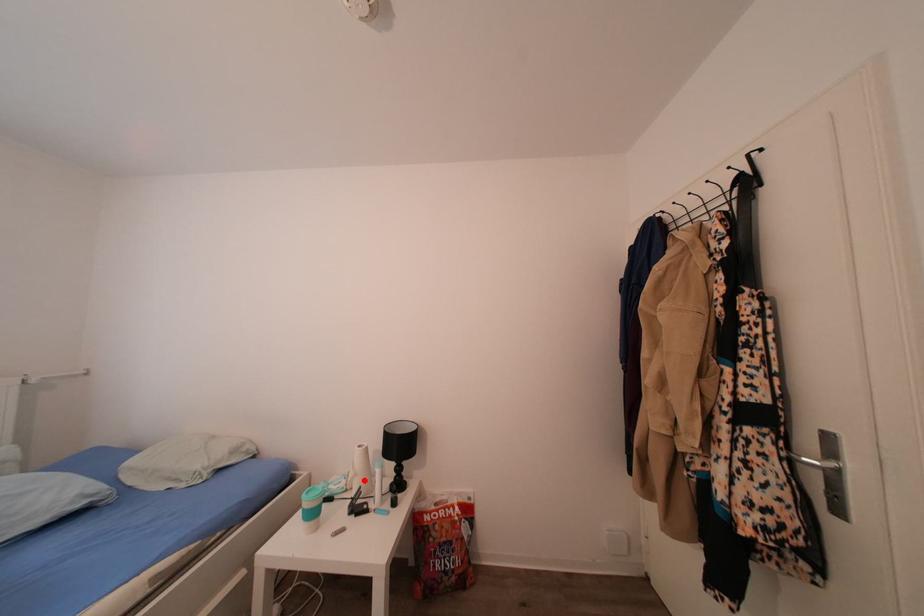
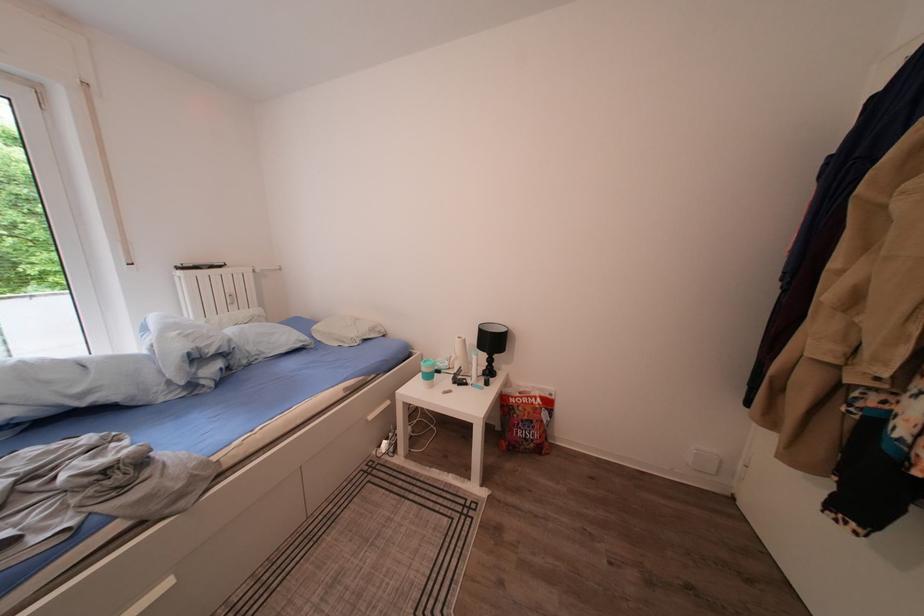
Find the pixel in the second image that matches the highlighted location in the first image.

(466, 363)